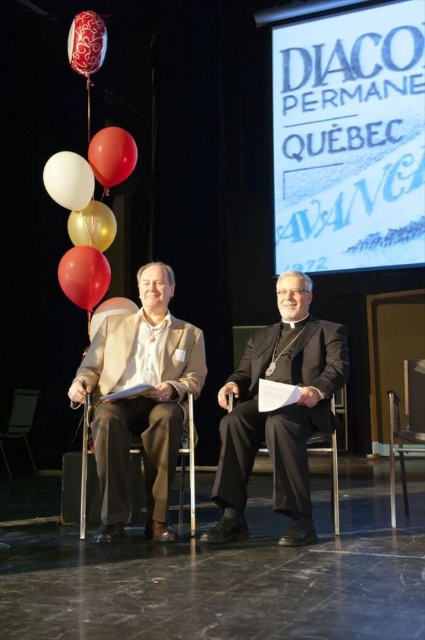
Between point (90, 260) and point (102, 28), which one is positioned behind?

The point (102, 28) is behind.

Is point (99, 296) in front of point (85, 36)?

No, (99, 296) is further to viewer.

The width and height of the screenshot is (425, 640). What are the coordinates of `rubberized red balloon at center` in the screenshot? It's located at click(x=84, y=275).

Does beige fabric suit at center appear under gold metallic balloon at center?

Correct, beige fabric suit at center is located below gold metallic balloon at center.

Measure the distance between point [184,413] and camera.

They are 3.63 meters apart.

Is point (130, 339) more distant than point (85, 236)?

No, (130, 339) is in front of (85, 236).

Where is `beige fabric suit at center`? The width and height of the screenshot is (425, 640). beige fabric suit at center is located at coordinates (141, 397).

Can you confirm if beige fabric suit at center is wider than red glossy balloon at upper left?

Yes.

Between beige fabric suit at center and red glossy balloon at upper left, which one is positioned lower?

beige fabric suit at center

The height and width of the screenshot is (640, 425). Find the location of `beige fabric suit at center`. beige fabric suit at center is located at coordinates (141, 397).